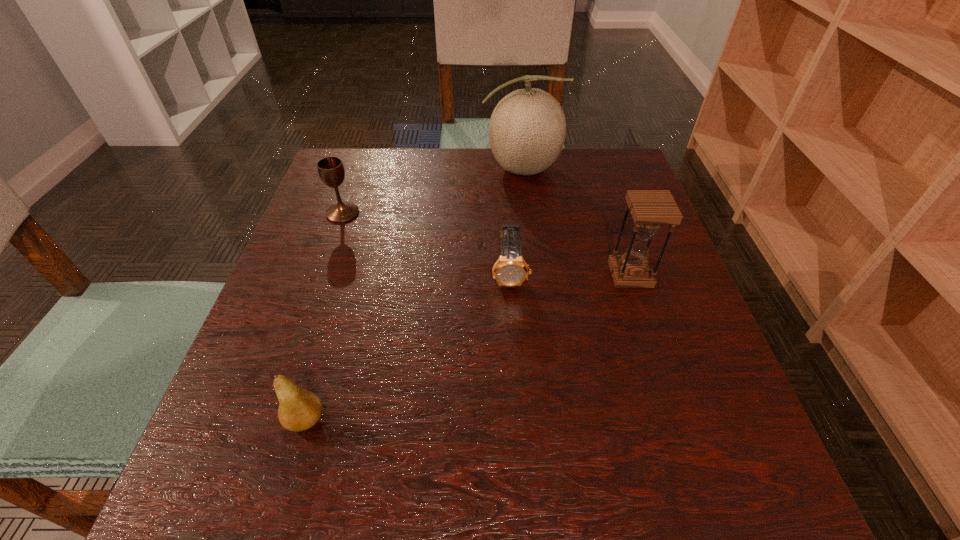
Locate an element on the screen. Image resolution: width=960 pixels, height=540 pixels. vacant space positioned 0.300m on the face of the watch is located at coordinates (520, 446).

Where is `vacant position located 0.240m on the back of the pear`? vacant position located 0.240m on the back of the pear is located at coordinates (343, 292).

Locate an element on the screen. The width and height of the screenshot is (960, 540). object present at the far edge is located at coordinates (527, 130).

The height and width of the screenshot is (540, 960). Identify the location of chalice that is at the left edge. (331, 170).

Find the location of `pear that is at the left edge`. pear that is at the left edge is located at coordinates (299, 409).

You are a GUI agent. You are given a task and a screenshot of the screen. Output one action in this format:
    pyautogui.click(x=<x>, y=<y>)
    Task: Click on the object that is positioned at the right edge
    
    Given the screenshot: What is the action you would take?
    pyautogui.click(x=651, y=209)

In order to click on vacant space at the far edge of the desktop in this screenshot , I will do `click(397, 194)`.

The height and width of the screenshot is (540, 960). I want to click on blank area at the left edge, so click(340, 265).

Locate an element on the screen. This screenshot has width=960, height=540. free point at the right edge is located at coordinates (656, 328).

Find the location of a particular element. The image size is (960, 540). blank space at the far left corner of the desktop is located at coordinates (348, 178).